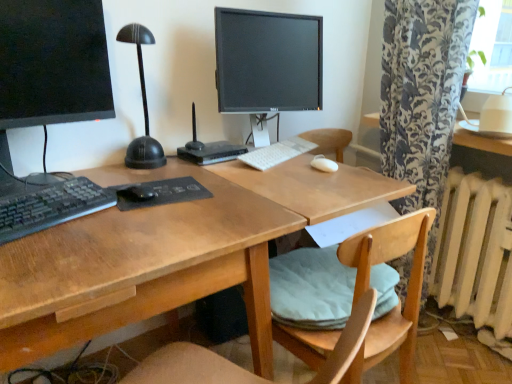
This screenshot has height=384, width=512. I want to click on empty space that is to the right of translucent plastic keyboard at left, so click(x=128, y=226).